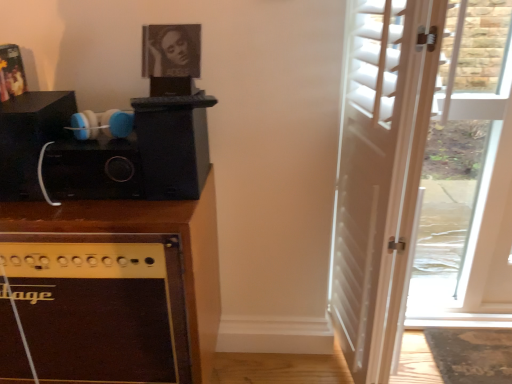
Question: Is the position of white wood door at right more distant than that of brown wood cabinet at left?

Choices:
 (A) no
 (B) yes

Answer: (A)

Question: Is brown wood cabinet at left located within white wood door at right?

Choices:
 (A) no
 (B) yes

Answer: (A)

Question: Could you tell me if white wood door at right is facing brown wood cabinet at left?

Choices:
 (A) no
 (B) yes

Answer: (A)

Question: Is white wood door at right in contact with brown wood cabinet at left?

Choices:
 (A) no
 (B) yes

Answer: (A)

Question: Can you confirm if white wood door at right is bigger than brown wood cabinet at left?

Choices:
 (A) no
 (B) yes

Answer: (A)

Question: Is matte black picture frame at upper center in front of or behind white wood door at right in the image?

Choices:
 (A) front
 (B) behind

Answer: (B)

Question: From a real-world perspective, is matte black picture frame at upper center physically located above or below white wood door at right?

Choices:
 (A) above
 (B) below

Answer: (A)

Question: Considering the relative positions of matte black picture frame at upper center and white wood door at right in the image provided, is matte black picture frame at upper center to the left or to the right of white wood door at right?

Choices:
 (A) right
 (B) left

Answer: (B)

Question: Is point coord(180,51) closer or farther from the camera than point coord(344,225)?

Choices:
 (A) farther
 (B) closer

Answer: (B)

Question: From their relative heights in the image, would you say matte black picture frame at upper center is taller or shorter than brown wood cabinet at left?

Choices:
 (A) short
 (B) tall

Answer: (A)

Question: From a real-world perspective, relative to brown wood cabinet at left, is matte black picture frame at upper center vertically above or below?

Choices:
 (A) above
 (B) below

Answer: (A)

Question: Is matte black picture frame at upper center bigger or smaller than brown wood cabinet at left?

Choices:
 (A) small
 (B) big

Answer: (A)

Question: In the image, is matte black picture frame at upper center positioned in front of or behind brown wood cabinet at left?

Choices:
 (A) behind
 (B) front

Answer: (A)

Question: Considering the relative positions of white wood door at right and matte black picture frame at upper center in the image provided, is white wood door at right to the left or to the right of matte black picture frame at upper center?

Choices:
 (A) left
 (B) right

Answer: (B)

Question: Considering the positions of point (339, 289) and point (179, 64), is point (339, 289) closer or farther from the camera than point (179, 64)?

Choices:
 (A) closer
 (B) farther

Answer: (B)